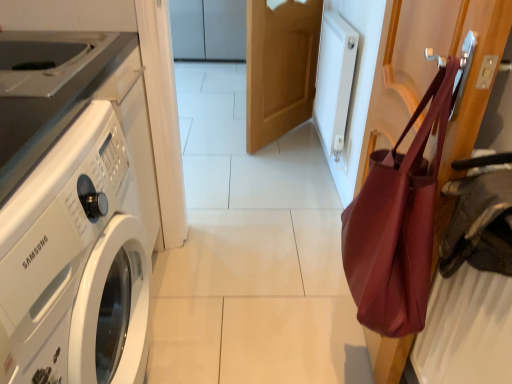
Locate an element on the screen. Image resolution: width=512 pixels, height=384 pixels. free space that is to the left of light brown wood door at center is located at coordinates (217, 140).